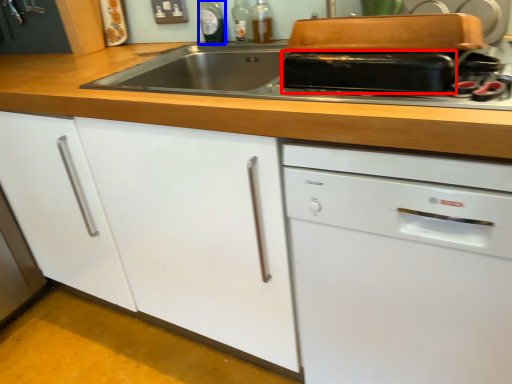
Question: Which object appears farthest to the camera in this image, kitchen appliance (highlighted by a red box) or bottle (highlighted by a blue box)?

Choices:
 (A) kitchen appliance
 (B) bottle

Answer: (B)